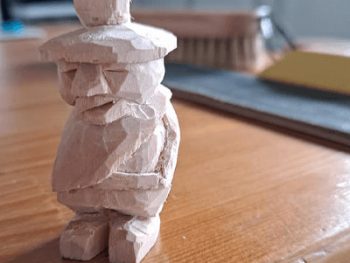
Identify the location of table. (264, 195), (228, 237), (208, 147), (207, 222), (21, 186), (28, 126), (42, 90).